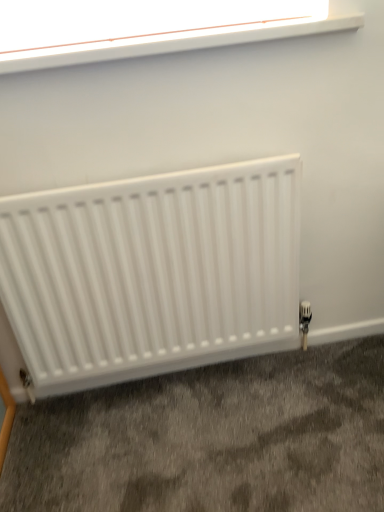
Question: Considering their positions, is white matte radiator at lower center located in front of or behind white plastic window at upper center?

Choices:
 (A) front
 (B) behind

Answer: (B)

Question: Is point (59, 257) positioned closer to the camera than point (178, 22)?

Choices:
 (A) closer
 (B) farther

Answer: (B)

Question: Visually, is white matte radiator at lower center positioned to the left or to the right of white plastic window at upper center?

Choices:
 (A) right
 (B) left

Answer: (B)

Question: Is white plastic window at upper center wider or thinner than white matte radiator at lower center?

Choices:
 (A) wide
 (B) thin

Answer: (A)

Question: Does point (296, 4) appear closer or farther from the camera than point (125, 360)?

Choices:
 (A) closer
 (B) farther

Answer: (A)

Question: Visually, is white plastic window at upper center positioned to the left or to the right of white matte radiator at lower center?

Choices:
 (A) left
 (B) right

Answer: (B)

Question: From their relative heights in the image, would you say white plastic window at upper center is taller or shorter than white matte radiator at lower center?

Choices:
 (A) tall
 (B) short

Answer: (B)